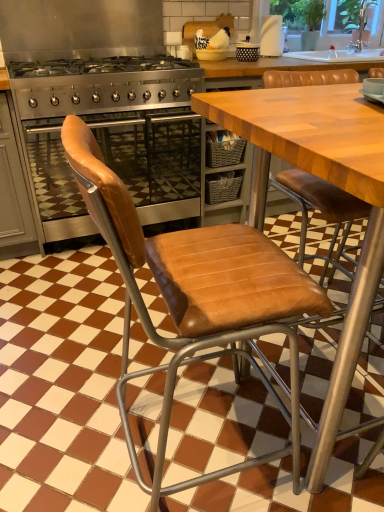
You are a GUI agent. You are given a task and a screenshot of the screen. Output one action in this format:
    pyautogui.click(x=<x>, y=<y>)
    Task: Click on the vacant area that is in front of stainless steel oven at left
    This screenshot has height=512, width=384.
    Given the screenshot: What is the action you would take?
    pyautogui.click(x=64, y=293)